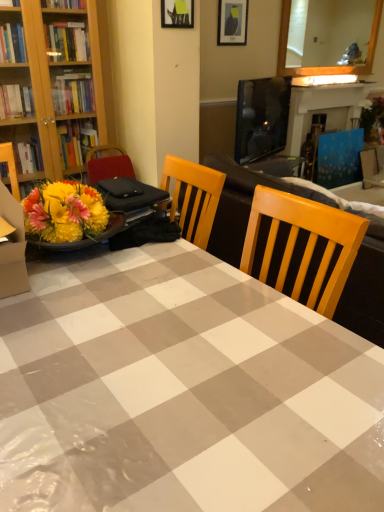
Where is `blue fabric armchair at right`? This screenshot has height=512, width=384. blue fabric armchair at right is located at coordinates click(339, 158).

The width and height of the screenshot is (384, 512). In order to click on gray checkered tablecloth at center in this screenshot , I will do `click(182, 392)`.

Image resolution: width=384 pixels, height=512 pixels. What do you see at coordinates (177, 13) in the screenshot?
I see `metallic silver picture frame at upper center, the second picture frame from the back` at bounding box center [177, 13].

Describe the element at coordinates (326, 66) in the screenshot. I see `wooden frame mirror at upper right` at that location.

Where is `blue fabric armchair at right`? The image size is (384, 512). blue fabric armchair at right is located at coordinates (339, 158).

Which of these two, gray checkered tablecloth at center or matte black picture frame at upper center, the 2th picture frame viewed from the left, is bigger?

Bigger between the two is gray checkered tablecloth at center.

Is gray checkered tablecloth at center facing away from matte black picture frame at upper center, positioned as the 1th picture frame in right-to-left order?

No, gray checkered tablecloth at center is not facing away from matte black picture frame at upper center, positioned as the 1th picture frame in right-to-left order.

Is gray checkered tablecloth at center in front of matte black picture frame at upper center, the 2th picture frame from the front?

Yes, gray checkered tablecloth at center is in front of matte black picture frame at upper center, the 2th picture frame from the front.

Is gray checkered tablecloth at center next to matte black picture frame at upper center, which is counted as the 1th picture frame, starting from the top?

No, gray checkered tablecloth at center is not in contact with matte black picture frame at upper center, which is counted as the 1th picture frame, starting from the top.

From a real-world perspective, starting from the blue painted wood fireplace at upper right, which picture frame is the 1st one vertically above it? Please provide its 2D coordinates.

[(177, 13)]

In the scene shown: Is the depth of metallic silver picture frame at upper center, the second picture frame from the back, less than that of blue painted wood fireplace at upper right?

Yes.

Is metallic silver picture frame at upper center, which is the 1th picture frame in left-to-right order, next to blue painted wood fireplace at upper right?

They are not placed beside each other.

Could blue painted wood fireplace at upper right be considered to be inside metallic silver picture frame at upper center, which is the 1th picture frame from front to back?

Actually, blue painted wood fireplace at upper right is outside metallic silver picture frame at upper center, which is the 1th picture frame from front to back.

Is blue painted wood fireplace at upper right next to metallic silver picture frame at upper center, the 1th picture frame when ordered from bottom to top?

No, blue painted wood fireplace at upper right is not making contact with metallic silver picture frame at upper center, the 1th picture frame when ordered from bottom to top.

At what (x,y) coordinates should I click in order to perform the action: click on fireplace behind the metallic silver picture frame at upper center, the 2th picture frame when ordered from top to bottom. Please return your answer as a coordinate pair (x, y). The height and width of the screenshot is (512, 384). Looking at the image, I should click on click(x=323, y=109).

Looking at this image, is blue painted wood fireplace at upper right bigger or smaller than metallic silver picture frame at upper center, the second picture frame from the back?

Considering their sizes, blue painted wood fireplace at upper right takes up more space than metallic silver picture frame at upper center, the second picture frame from the back.

From a real-world perspective, between metallic silver picture frame at upper center, the 1th picture frame when ordered from bottom to top, and blue fabric armchair at right, who is vertically higher?

In real-world perspective, metallic silver picture frame at upper center, the 1th picture frame when ordered from bottom to top, is above.

Between metallic silver picture frame at upper center, which is the second picture frame from right to left, and blue fabric armchair at right, which one has smaller size?

metallic silver picture frame at upper center, which is the second picture frame from right to left.

Does metallic silver picture frame at upper center, which is the second picture frame from right to left, have a lesser width compared to blue fabric armchair at right?

Yes.

How many degrees apart are the facing directions of metallic silver picture frame at upper center, which is the second picture frame from right to left, and blue fabric armchair at right?

The angle between the facing direction of metallic silver picture frame at upper center, which is the second picture frame from right to left, and the facing direction of blue fabric armchair at right is 2.24 degrees.

Which object is further away from the camera taking this photo, blue fabric armchair at right or gray checkered tablecloth at center?

blue fabric armchair at right is further away from the camera.

Considering the points (350, 169) and (61, 404), which point is in front, point (350, 169) or point (61, 404)?

The point (61, 404) is more forward.

Looking at this image, is blue fabric armchair at right facing away from gray checkered tablecloth at center?

That's not correct — blue fabric armchair at right is not looking away from gray checkered tablecloth at center.

In terms of width, does blue fabric armchair at right look wider or thinner when compared to gray checkered tablecloth at center?

blue fabric armchair at right is thinner than gray checkered tablecloth at center.

The height and width of the screenshot is (512, 384). Identify the location of desk that is under the wooden frame mirror at upper right (from a real-world perspective). (182, 392).

Is wooden frame mirror at upper right looking in the opposite direction of gray checkered tablecloth at center?

No, gray checkered tablecloth at center is not at the back of wooden frame mirror at upper right.

Is point (347, 71) farther from viewer compared to point (176, 400)?

Yes, it is.

In the scene shown: Does wooden frame mirror at upper right have a greater height compared to gray checkered tablecloth at center?

Correct, wooden frame mirror at upper right is much taller as gray checkered tablecloth at center.

Between gray checkered tablecloth at center and metallic silver picture frame at upper center, the 1th picture frame when ordered from bottom to top, which one appears on the right side from the viewer's perspective?

metallic silver picture frame at upper center, the 1th picture frame when ordered from bottom to top.

From the image's perspective, is gray checkered tablecloth at center below metallic silver picture frame at upper center, which is the second picture frame from right to left?

Indeed, from the image's perspective, gray checkered tablecloth at center is shown beneath metallic silver picture frame at upper center, which is the second picture frame from right to left.

Starting from the gray checkered tablecloth at center, which picture frame is the 1st one behind? Please provide its 2D coordinates.

[(177, 13)]

Is gray checkered tablecloth at center outside of metallic silver picture frame at upper center, which is the second picture frame from right to left?

Absolutely, gray checkered tablecloth at center is external to metallic silver picture frame at upper center, which is the second picture frame from right to left.

Identify the location of desk that appears on the left of matte black picture frame at upper center, which is counted as the 1th picture frame, starting from the top. (182, 392).

From the image's perspective, count 1st picture frames upward from the blue painted wood fireplace at upper right and point to it. Please provide its 2D coordinates.

[(177, 13)]

Looking at the image, which one is located closer to gray checkered tablecloth at center, wooden frame mirror at upper right or blue fabric armchair at right?

blue fabric armchair at right is positioned closer to the anchor gray checkered tablecloth at center.

Based on their spatial positions, is blue painted wood fireplace at upper right or gray checkered tablecloth at center closer to metallic silver picture frame at upper center, which is the 1th picture frame in left-to-right order?

gray checkered tablecloth at center is closer to metallic silver picture frame at upper center, which is the 1th picture frame in left-to-right order.

In the scene shown: Considering their positions, is gray checkered tablecloth at center positioned further to matte black picture frame at upper center, positioned as the first picture frame in back-to-front order, than blue painted wood fireplace at upper right?

Based on the image, gray checkered tablecloth at center appears to be further to matte black picture frame at upper center, positioned as the first picture frame in back-to-front order.

Considering their positions, is matte black picture frame at upper center, the second picture frame when ordered from bottom to top, positioned closer to metallic silver picture frame at upper center, which is the 1th picture frame from front to back, than wooden frame mirror at upper right?

matte black picture frame at upper center, the second picture frame when ordered from bottom to top, lies closer to metallic silver picture frame at upper center, which is the 1th picture frame from front to back, than the other object.

Considering their positions, is gray checkered tablecloth at center positioned further to blue painted wood fireplace at upper right than blue fabric armchair at right?

The object further to blue painted wood fireplace at upper right is gray checkered tablecloth at center.

From the image, which object appears to be nearer to gray checkered tablecloth at center, blue painted wood fireplace at upper right or metallic silver picture frame at upper center, the second picture frame from the back?

The object closer to gray checkered tablecloth at center is metallic silver picture frame at upper center, the second picture frame from the back.

When comparing their distances from blue fabric armchair at right, does matte black picture frame at upper center, the 2th picture frame from the front, or wooden frame mirror at upper right seem closer?

Among the two, wooden frame mirror at upper right is located nearer to blue fabric armchair at right.

When comparing their distances from blue painted wood fireplace at upper right, does matte black picture frame at upper center, the 2th picture frame viewed from the left, or gray checkered tablecloth at center seem further?

gray checkered tablecloth at center.

Locate an element on the screen. mirror between matte black picture frame at upper center, the 2th picture frame from the front, and blue painted wood fireplace at upper right, in the horizontal direction is located at coordinates (326, 66).

The image size is (384, 512). In order to click on picture frame between metallic silver picture frame at upper center, which is the 1th picture frame in left-to-right order, and blue fabric armchair at right, in the horizontal direction in this screenshot , I will do `click(232, 22)`.

This screenshot has height=512, width=384. Identify the location of mirror between matte black picture frame at upper center, the second picture frame when ordered from bottom to top, and blue fabric armchair at right. (326, 66).

Locate an element on the screen. Image resolution: width=384 pixels, height=512 pixels. fireplace located between metallic silver picture frame at upper center, which is the second picture frame from right to left, and blue fabric armchair at right in the left-right direction is located at coordinates (323, 109).